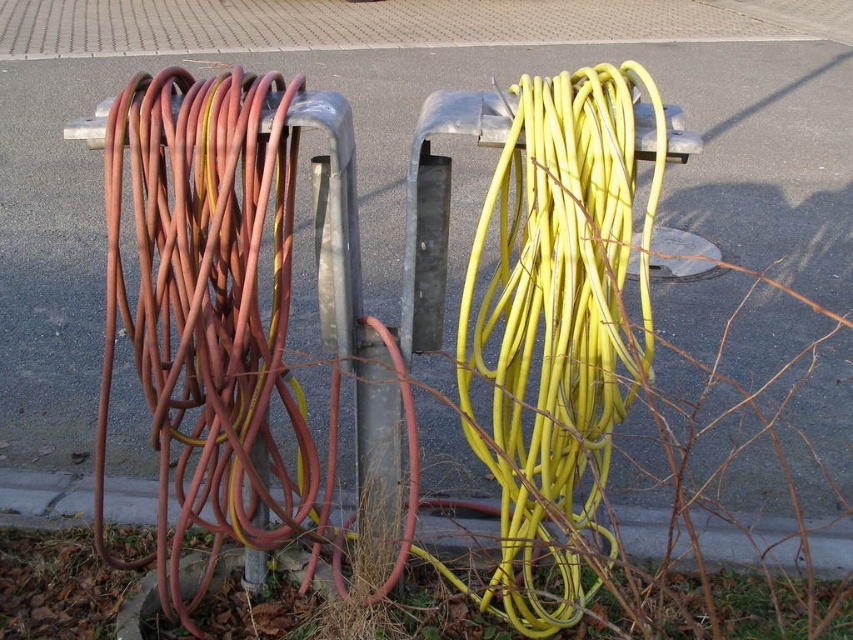
You are a maintenance worker needing to retrieve a hose for a task. You see the matte red hose at left and the yellow rubber hose at center. Which one can you reach without moving the other?

The matte red hose at left is closer to you than the yellow rubber hose at center, so you can reach it without moving the other.

You are a gardener who needs to water plants near the gray concrete curb at lower center. You have the matte red hose at left. Can you easily access the curb with the hose without moving any large objects?

The matte red hose at left is in front of the gray concrete curb at lower center, so you can easily access the curb with the hose without needing to move any large objects.

You are a maintenance worker who needs to locate the matte red hose at left. Based on the coordinates provided, where should you look relative to the two metal racks in the image?

The matte red hose at left is located at coordinates point (202, 305), which would be on the left metal rack since the hose is described as being at the left rack.